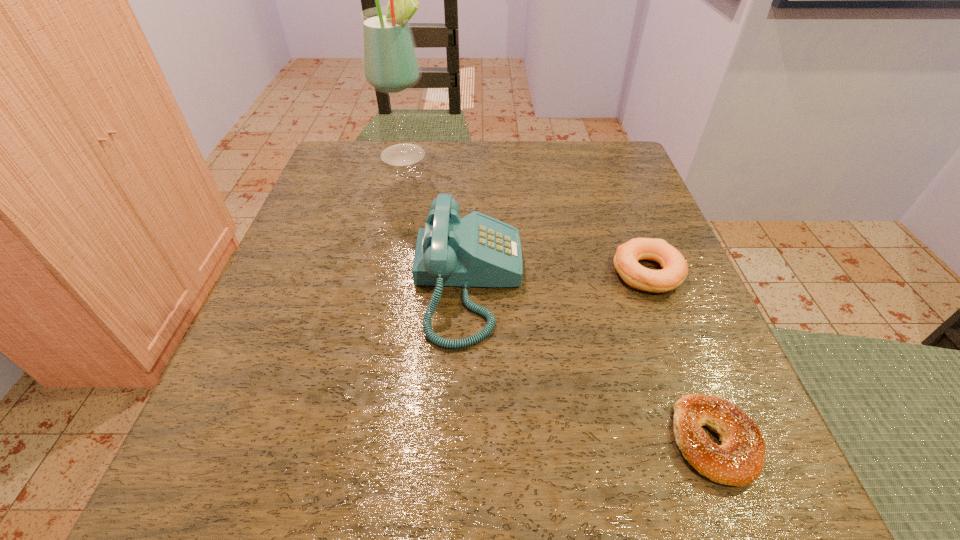
Find the location of a particular element. vacant area that lies between the alcohol and the shortest object is located at coordinates (560, 298).

You are a GUI agent. You are given a task and a screenshot of the screen. Output one action in this format:
    pyautogui.click(x=<x>, y=<y>)
    Task: Click on the second closest object to the taller bagel
    The height and width of the screenshot is (540, 960).
    Given the screenshot: What is the action you would take?
    point(739,460)

Identify the location of object that is the third closest to the alcohol. This screenshot has width=960, height=540. (739, 460).

Find the location of a particular element. This screenshot has height=540, width=960. vacant area that satisfies the following two spatial constraints: 1. on the dial of the nearest object; 2. on the right side of the telephone is located at coordinates (465, 441).

Identify the location of free point that satisfies the following two spatial constraints: 1. on the back side of the nearer bagel; 2. on the dial of the telephone. (653, 284).

I want to click on free region that satisfies the following two spatial constraints: 1. on the dial of the nearest object; 2. on the left side of the third shortest object, so click(x=465, y=441).